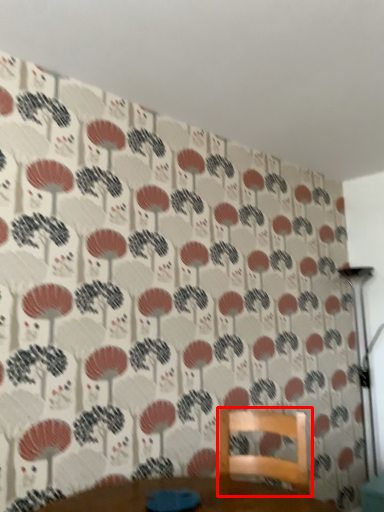
Question: From the image's perspective, where is furniture (annotated by the red box) located relative to table lamp?

Choices:
 (A) above
 (B) below

Answer: (B)